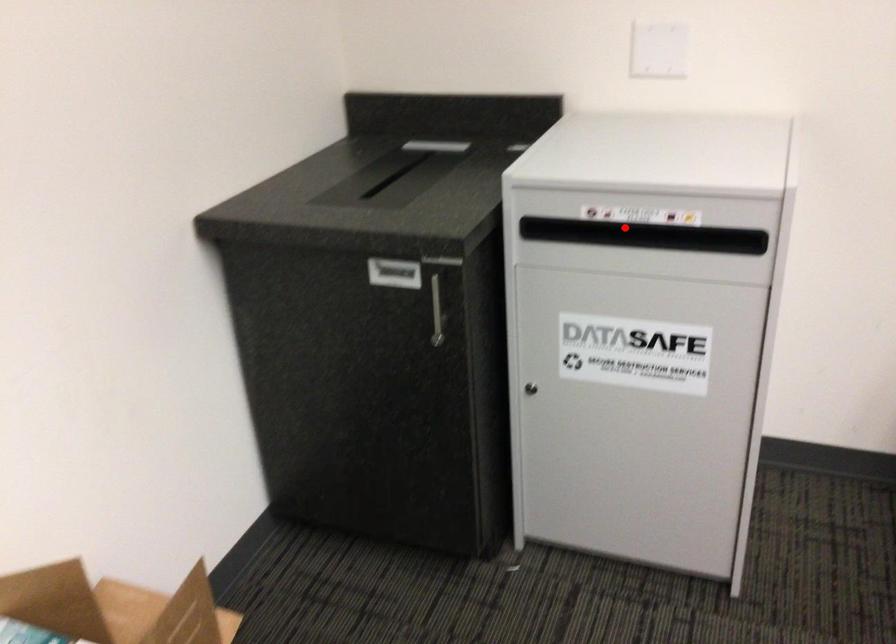
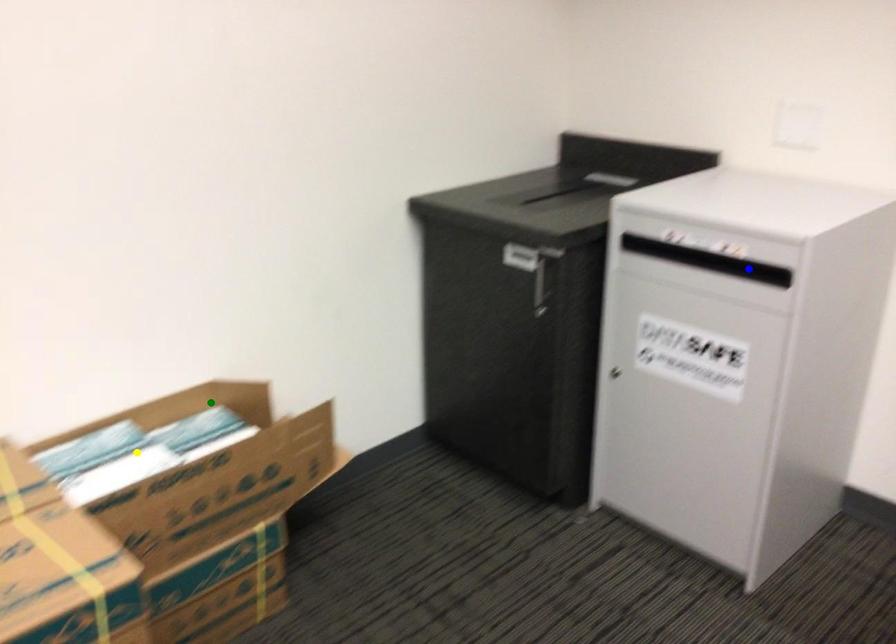
Question: I am providing you with two images of the same scene from different viewpoints. A red point is marked on the first image. You are given multiple points on the second image. Can you choose the point in image 2 that corresponds to the point in image 1?

Choices:
 (A) yellow point
 (B) green point
 (C) blue point

Answer: (C)